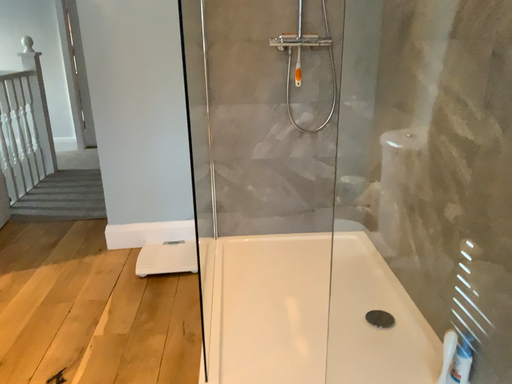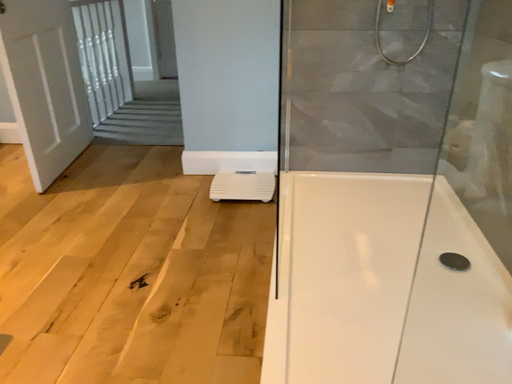
Question: Which way did the camera rotate in the video?

Choices:
 (A) rotated upward
 (B) rotated downward

Answer: (B)